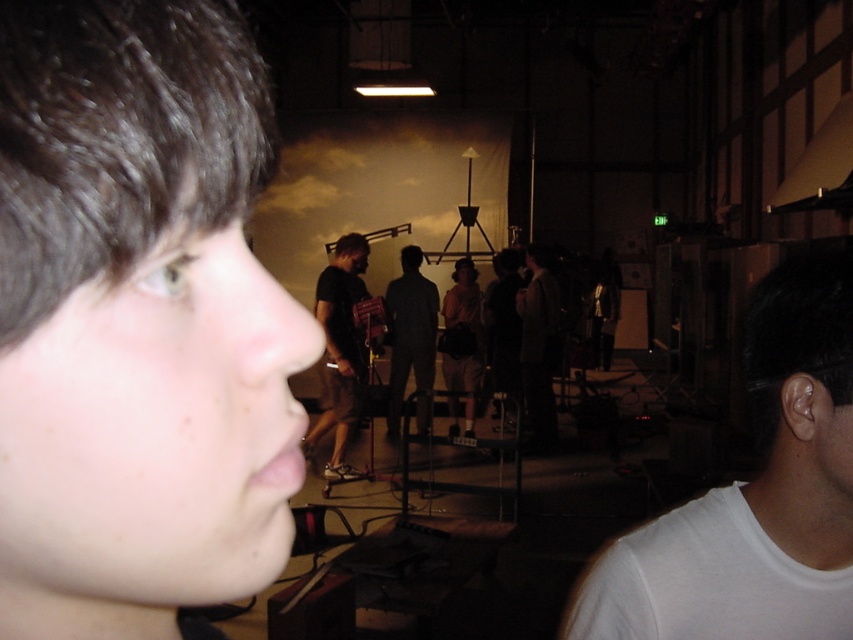
You are an event organizer who needs to determine the appropriate size of a rental chair for attendees. You notice two items at the center of the image, dark gray pants at center and khaki cotton shorts at center. Which of these items is bigger in size?

The dark gray pants at center is larger in size than khaki cotton shorts at center, so the dark gray pants at center is the bigger item.